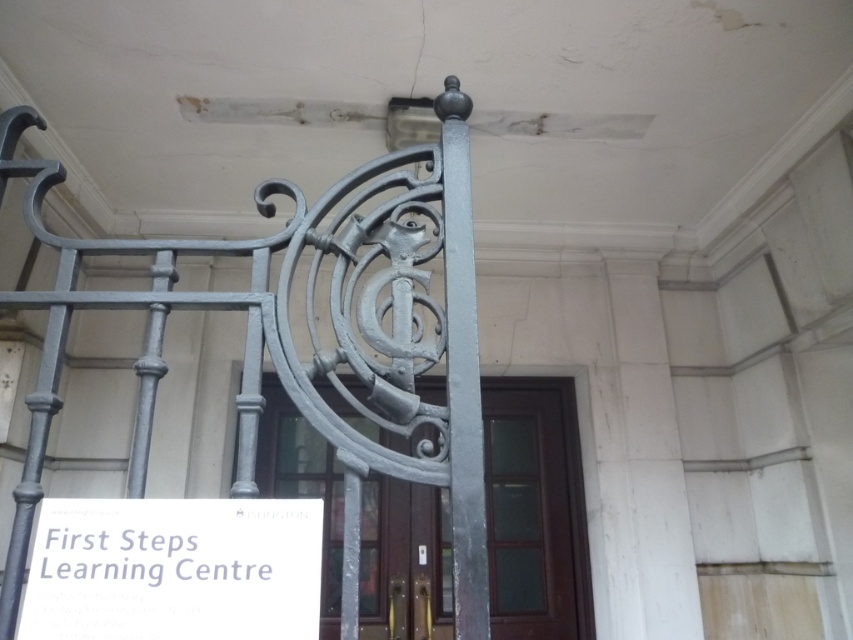
You are a delivery person trying to access the entrance. You see the matte gray metal gate at center and the gray metal pole at center. Which object is closer to the left side of the entrance?

The matte gray metal gate at center is positioned on the left side of the gray metal pole at center, so it is closer to the left side of the entrance.

You are a delivery person with a large box that is 2 meters long. You need to pass through the entrance shown in the image. Can you fit the box through the space between the matte gray metal gate at center and the polished wood door at center?

The distance between the matte gray metal gate at center and the polished wood door at center is 1.96 meters. Since the box is 2 meters long, it is slightly longer than the available space, so the box cannot fit through the entrance.

You are a delivery person with a cart that is 6 feet wide. You need to move your cart through the entrance area shown in the image. Can you fit your cart between the polished wood door at center and the gray metal pole at center?

The distance between the polished wood door at center and the gray metal pole at center is 7.05 feet. Since your cart is 6 feet wide, it can fit through the space between them as 7.05 feet is wider than 6 feet.